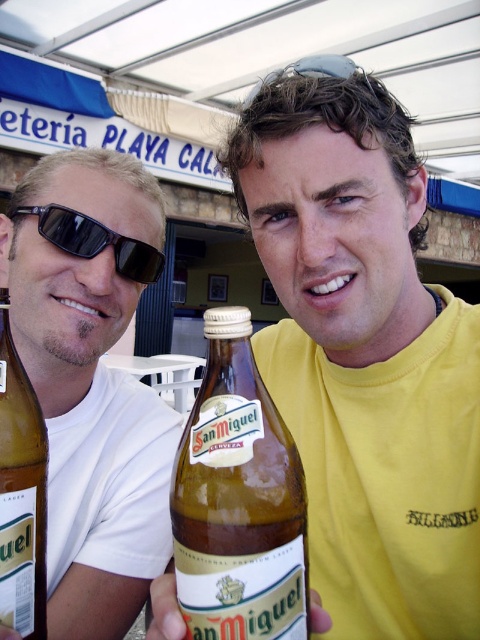
Question: Can you confirm if yellow matte shirt at center is positioned to the left of brown glass bottle at center?

Choices:
 (A) no
 (B) yes

Answer: (A)

Question: Which is nearer to the black plastic sunglasses at left?

Choices:
 (A) matte white shirt at center
 (B) brown glass bottle at center
 (C) sunglasses at center
 (D) translucent glass bottle at center

Answer: (A)

Question: Is brown glass bottle at center above translucent glass bottle at center?

Choices:
 (A) no
 (B) yes

Answer: (B)

Question: Considering the real-world distances, which object is farthest from the black plastic sunglasses at left?

Choices:
 (A) brown glass bottle at center
 (B) sunglasses at center
 (C) matte white shirt at center
 (D) yellow matte shirt at center

Answer: (A)

Question: Which object is farther from the camera taking this photo?

Choices:
 (A) matte white shirt at center
 (B) brown glass bottle at center
 (C) translucent glass bottle at center
 (D) yellow matte shirt at center

Answer: (A)

Question: Is translucent glass bottle at center closer to the viewer compared to sunglasses at center?

Choices:
 (A) no
 (B) yes

Answer: (B)